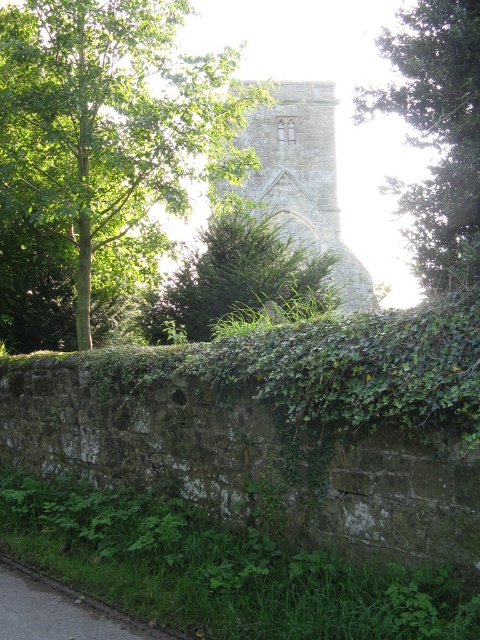
Question: Which point appears farthest from the camera in this image?

Choices:
 (A) (27, 636)
 (B) (264, 92)

Answer: (B)

Question: Does green leafy tree at left have a greater width compared to gray asphalt path at lower left?

Choices:
 (A) yes
 (B) no

Answer: (A)

Question: Where is green leafy tree at left located in relation to green leafy hedge at center in the image?

Choices:
 (A) below
 (B) above

Answer: (B)

Question: Estimate the real-world distances between objects in this image. Which object is closer to the stone tower at center?

Choices:
 (A) green leafy tree at left
 (B) green leafy tree at upper center

Answer: (A)

Question: Based on their relative distances, which object is farther from the stone tower at center?

Choices:
 (A) green leafy hedge at center
 (B) green leafy tree at upper center
 (C) gray asphalt path at lower left
 (D) green leafy tree at left

Answer: (C)

Question: Is green leafy tree at left to the right of stone tower at center from the viewer's perspective?

Choices:
 (A) yes
 (B) no

Answer: (B)